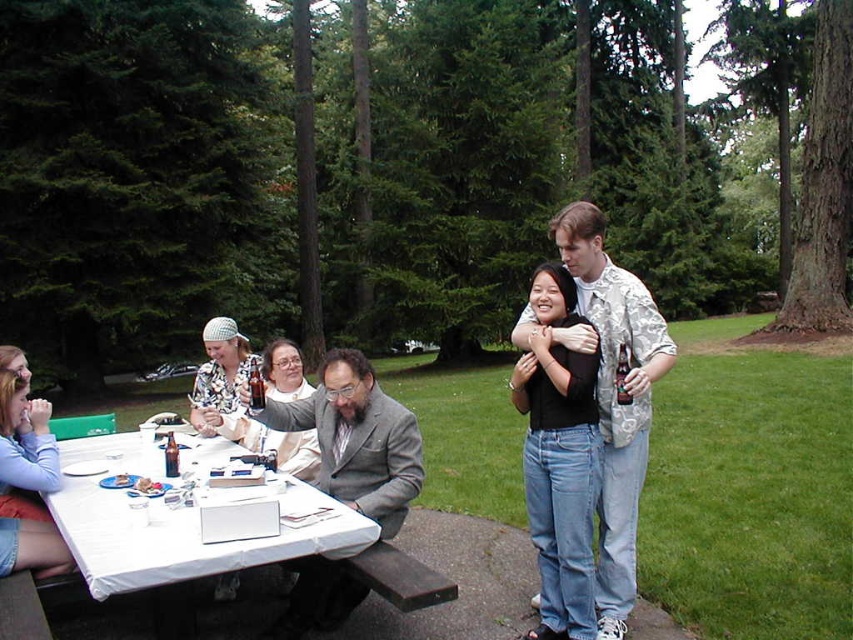
Is point (134, 461) positioned behind point (601, 228)?

Yes, it is.

Does white plastic table at lower left appear on the left side of white floral shirt at upper right?

Indeed, white plastic table at lower left is positioned on the left side of white floral shirt at upper right.

Who is more distant from viewer, (157, 460) or (624, 557)?

Point (157, 460)

Where is `white plastic table at lower left`? white plastic table at lower left is located at coordinates (181, 518).

Is white floral shirt at upper right shorter than gray wool suit at center?

No, white floral shirt at upper right is not shorter than gray wool suit at center.

Is white floral shirt at upper right closer to the viewer compared to gray wool suit at center?

Yes, it is.

Which is behind, point (581, 212) or point (287, 628)?

The point (287, 628) is behind.

The image size is (853, 640). Identify the location of white floral shirt at upper right. (613, 394).

Does matte gray suit at center appear under white floral shirt at upper right?

Indeed, matte gray suit at center is positioned under white floral shirt at upper right.

From the picture: Is matte gray suit at center bigger than white floral shirt at upper right?

Yes, matte gray suit at center is bigger than white floral shirt at upper right.

Between point (587, 627) and point (648, 381), which one is positioned in front?

Point (648, 381) is in front.

I want to click on matte gray suit at center, so click(x=618, y=536).